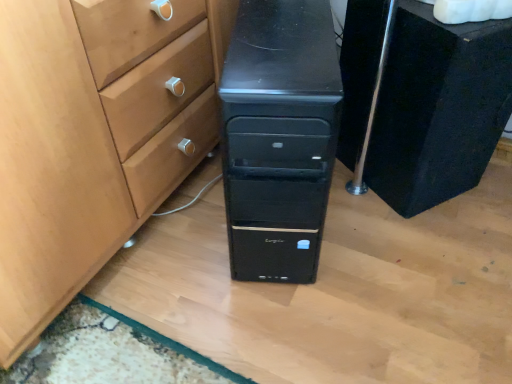
The width and height of the screenshot is (512, 384). Find the location of `free space in front of black matte chest of drawers at center, which appears as the first chest of drawers when viewed from the right`. free space in front of black matte chest of drawers at center, which appears as the first chest of drawers when viewed from the right is located at coordinates (420, 252).